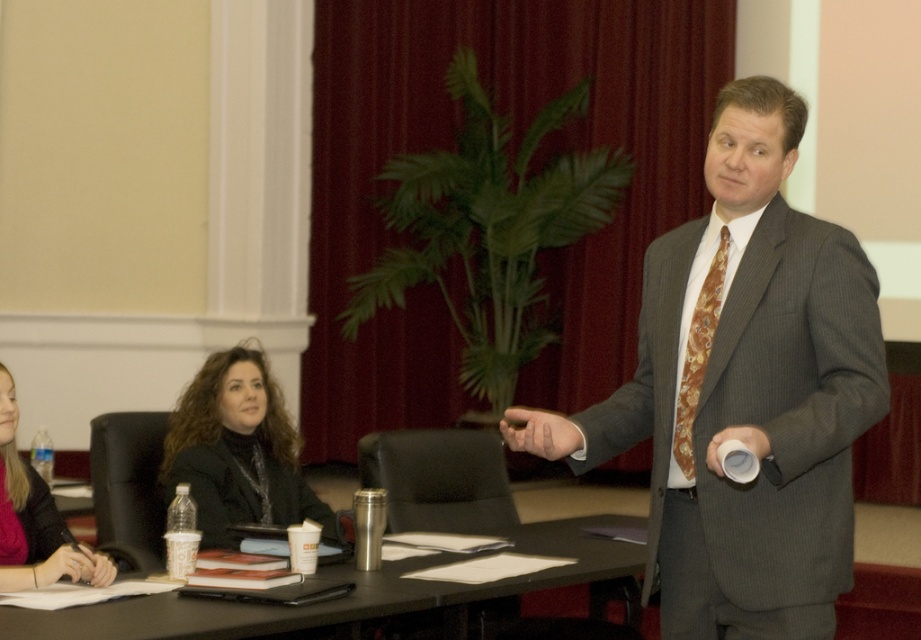
You are organizing a formal event and need to ensure that the gray pinstripe suit at center and the brown silk tie at center can be accommodated in a display case. The case has a width of 1 meter. Can both items fit side by side without overlapping?

The gray pinstripe suit at center is wider than the brown silk tie at center. Since the total width of both items combined would exceed the 1 meter display case, they cannot fit side by side without overlapping.